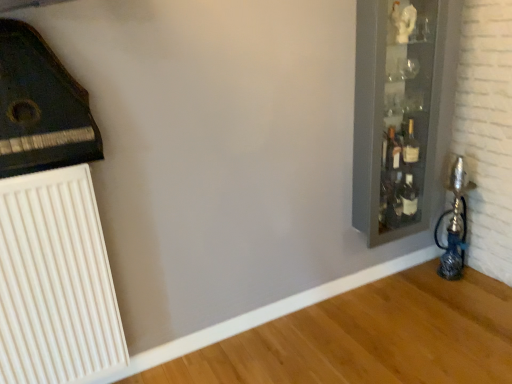
Question: From a real-world perspective, is white plastic radiator at lower left above or below translucent glass bottle at right?

Choices:
 (A) above
 (B) below

Answer: (B)

Question: Is white plastic radiator at lower left to the left or to the right of translucent glass bottle at right in the image?

Choices:
 (A) right
 (B) left

Answer: (B)

Question: Which of these objects is positioned closest to the clear glass cabinet at right?

Choices:
 (A) white plastic radiator at lower left
 (B) translucent glass bottle at right

Answer: (B)

Question: Estimate the real-world distances between objects in this image. Which object is closer to the clear glass cabinet at right?

Choices:
 (A) translucent glass bottle at right
 (B) white plastic radiator at lower left

Answer: (A)